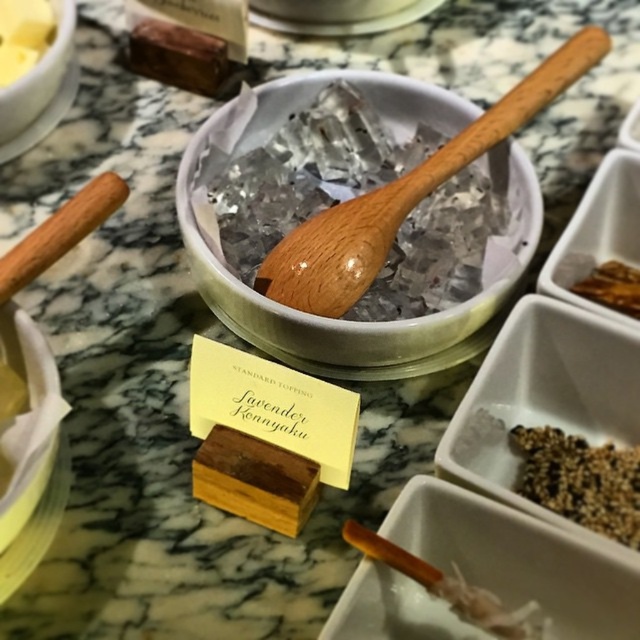
You are preparing a snack platter and have a white ceramic bowl at upper left and a brown crispy snack at upper right on the marble countertop. Which item has a greater width?

The white ceramic bowl at upper left has a greater width than the brown crispy snack at upper right.

You are a chef preparing a dish and need to choose between the wooden spoon at center and the yellow butter at upper left. Which item is bigger in size?

The wooden spoon at center is larger in size than the yellow butter at upper left, so the wooden spoon at center is bigger.